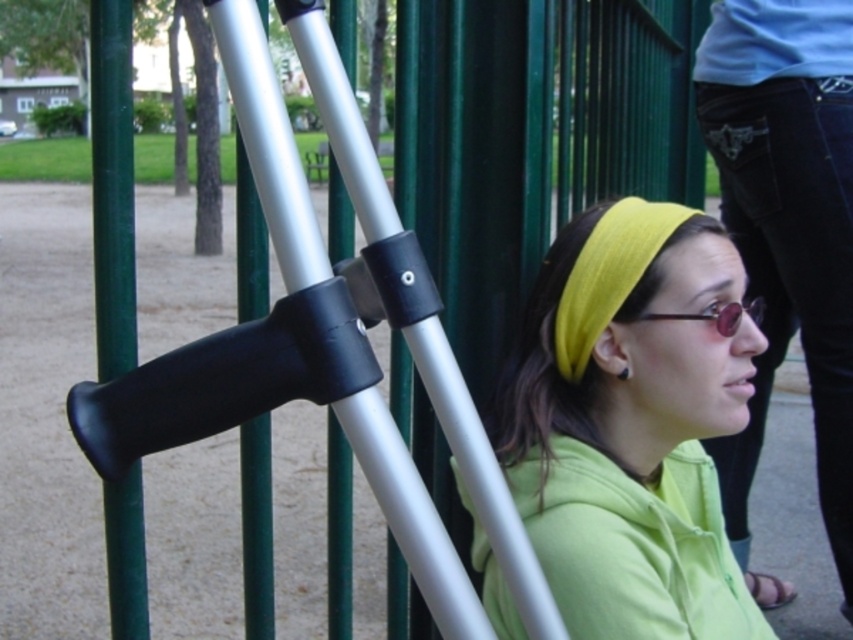
Who is lower down, black rubber crutch at center or sunglasses at center?

black rubber crutch at center is lower down.

At what (x,y) coordinates should I click in order to perform the action: click on black rubber crutch at center. Please return your answer as a coordinate pair (x, y). Looking at the image, I should click on (325, 342).

Where is `black rubber crutch at center`? This screenshot has width=853, height=640. black rubber crutch at center is located at coordinates (325, 342).

Does lime green fabric at center have a lesser width compared to black rubber crutch at center?

No.

Is lime green fabric at center further to the viewer compared to black rubber crutch at center?

Yes, lime green fabric at center is behind black rubber crutch at center.

The height and width of the screenshot is (640, 853). What are the coordinates of `lime green fabric at center` in the screenshot? It's located at (631, 422).

This screenshot has width=853, height=640. Find the location of `lime green fabric at center`. lime green fabric at center is located at coordinates (631, 422).

From the picture: Which is above, green matte pole at center-left or sunglasses at center?

green matte pole at center-left is above.

Who is shorter, green matte pole at center-left or sunglasses at center?

Standing shorter between the two is sunglasses at center.

Identify the location of green matte pole at center-left. The image size is (853, 640). (112, 186).